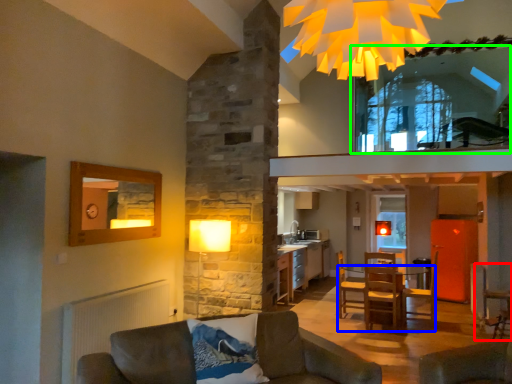
Question: Considering the real-world distances, which object is closest to armchair (highlighted by a red box)? table (highlighted by a blue box) or window (highlighted by a green box).

Choices:
 (A) table
 (B) window

Answer: (A)